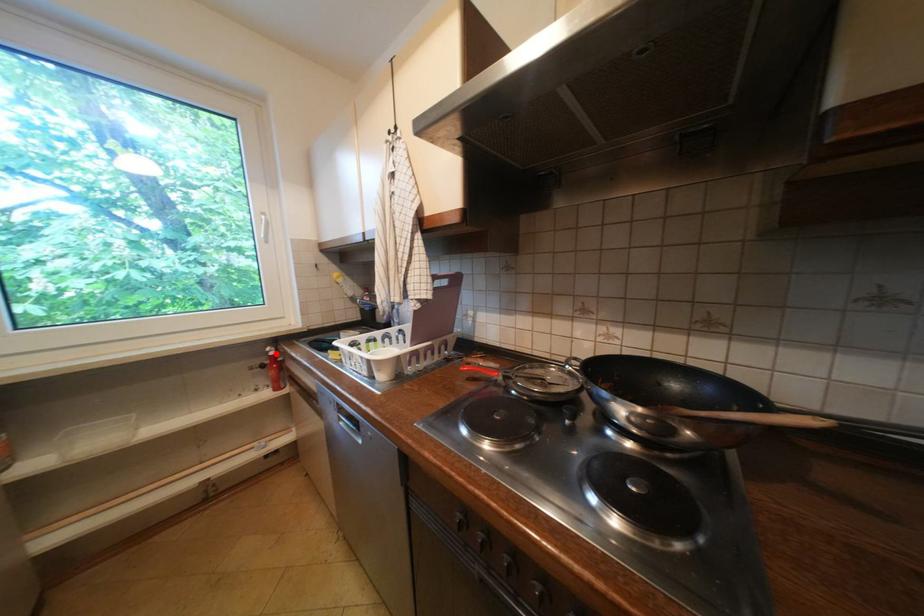
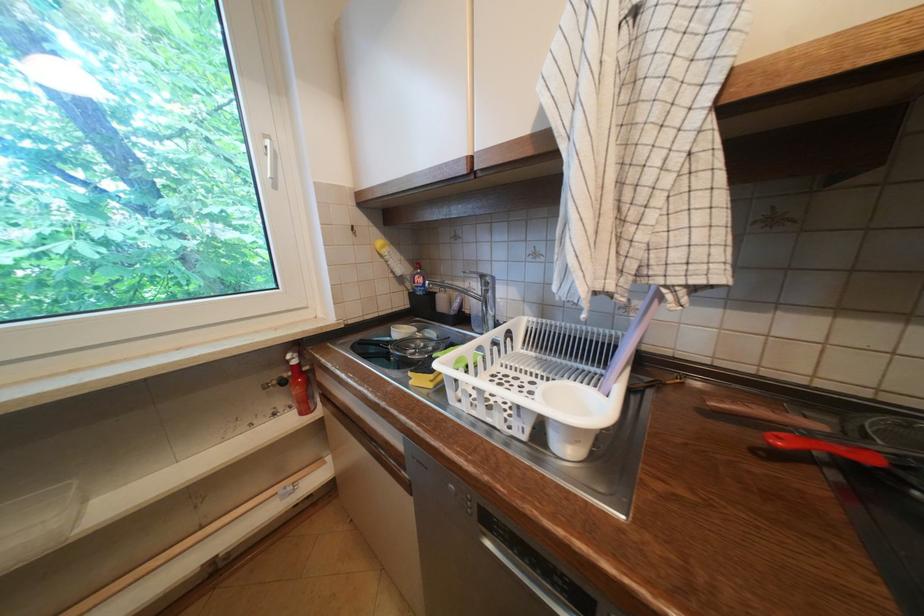
Locate, in the second image, the point that corresponds to the highlighted location in the first image.

(296, 362)